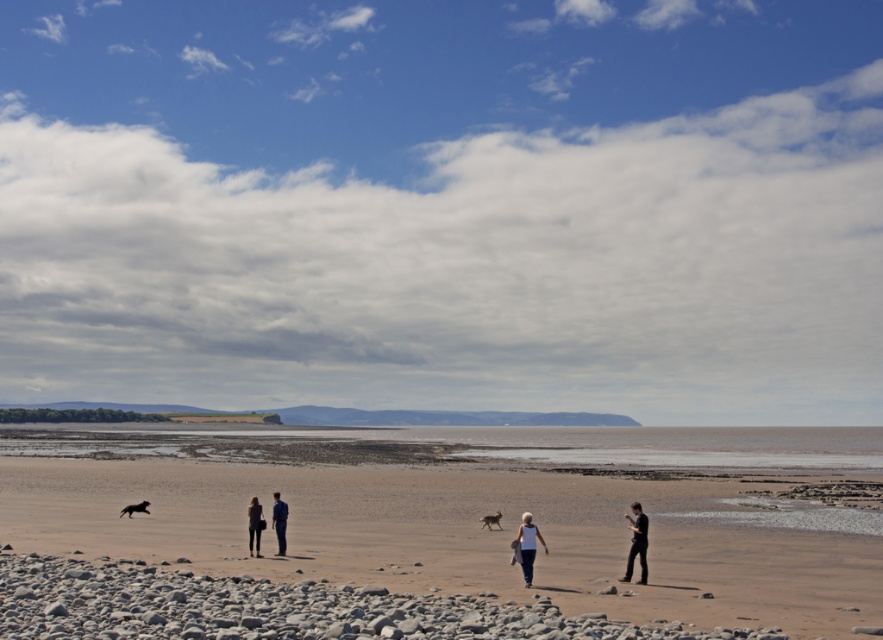
Is light brown sand at center shorter than white fabric at center?

In fact, light brown sand at center may be taller than white fabric at center.

Can you confirm if light brown sand at center is smaller than white fabric at center?

Incorrect, light brown sand at center is not smaller in size than white fabric at center.

Between point (225, 561) and point (527, 576), which one is positioned in front?

Point (527, 576)

Where is `light brown sand at center`? This screenshot has height=640, width=883. light brown sand at center is located at coordinates (323, 516).

Does smooth pebble at lower left have a greater height compared to dark blue jeans at center?

In fact, smooth pebble at lower left may be shorter than dark blue jeans at center.

Find the location of a particular element. The image size is (883, 640). smooth pebble at lower left is located at coordinates (278, 609).

Can you confirm if blue fabric jacket at center is positioned below black fur dog at lower left?

Yes, blue fabric jacket at center is below black fur dog at lower left.

This screenshot has width=883, height=640. What are the coordinates of `blue fabric jacket at center` in the screenshot? It's located at pyautogui.click(x=278, y=522).